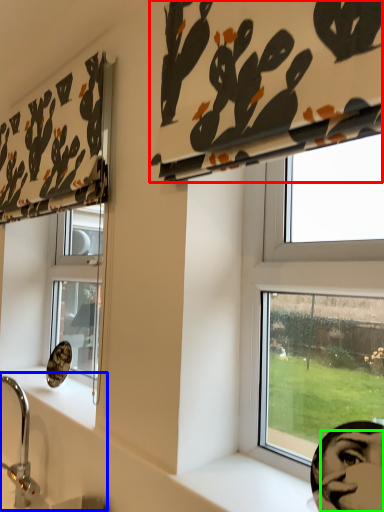
Question: Which object is the closest to the curtain (highlighted by a red box)? Choose among these: sink (highlighted by a blue box) or human face (highlighted by a green box).

Choices:
 (A) sink
 (B) human face

Answer: (B)